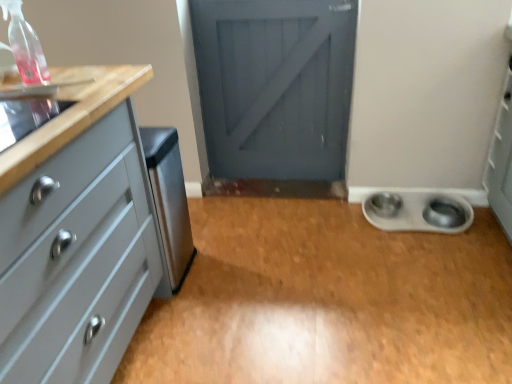
You are a GUI agent. You are given a task and a screenshot of the screen. Output one action in this format:
    pyautogui.click(x=<x>, y=<y>)
    Task: Click on the vacant area that is situated to the right of clear plastic spray bottle at upper left
    
    Given the screenshot: What is the action you would take?
    pyautogui.click(x=86, y=86)